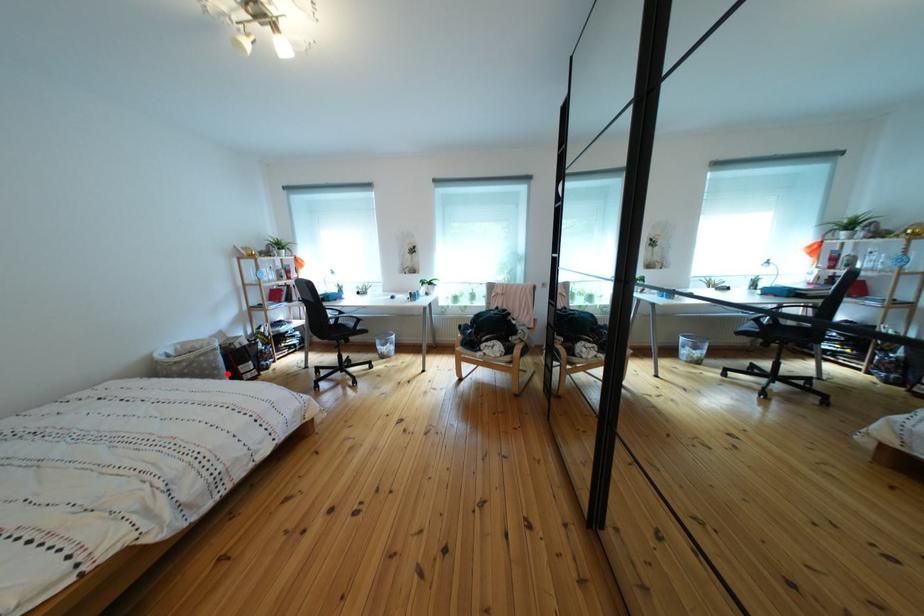
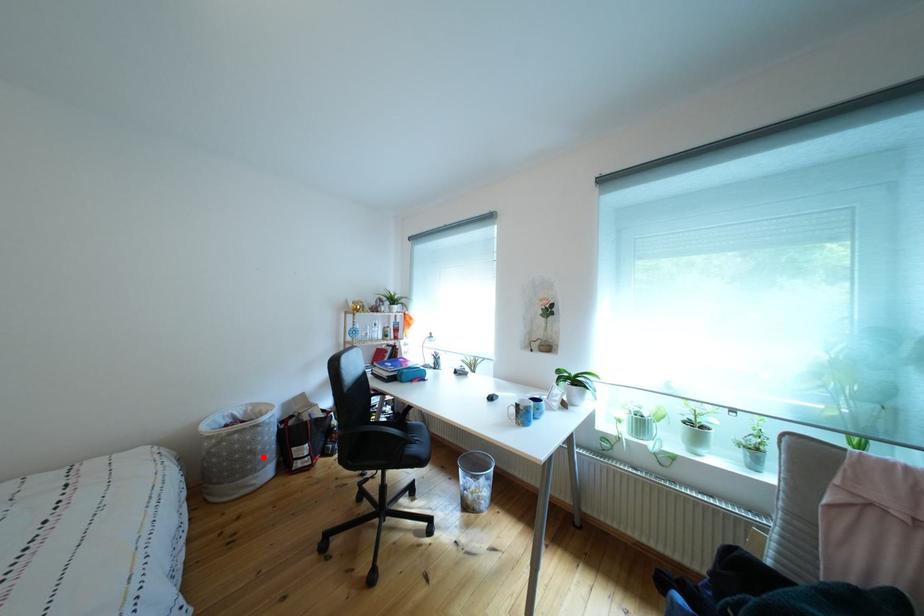
I am providing you with two images of the same scene from different viewpoints. A red point is marked on the first image and another point is marked on the second image. Are the points marked in image1 and image2 representing the same 3D position?

Yes